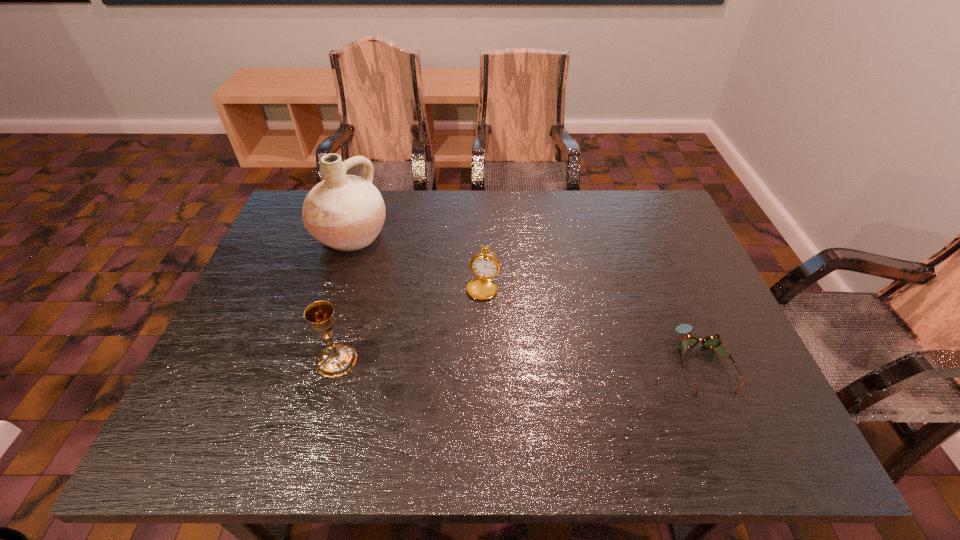
This screenshot has width=960, height=540. I want to click on empty location between the chalice and the second shortest object, so click(x=415, y=324).

You are a GUI agent. You are given a task and a screenshot of the screen. Output one action in this format:
    pyautogui.click(x=<x>, y=<y>)
    Task: Click on the vacant point located between the spectacles and the pottery
    The image size is (960, 540).
    Given the screenshot: What is the action you would take?
    pyautogui.click(x=527, y=298)

In order to click on unoccupied area between the rightmost object and the second object from right to left in this screenshot , I will do `click(598, 325)`.

The image size is (960, 540). Identify the location of vacant region between the shortest object and the farthest object. (527, 298).

At what (x,y) coordinates should I click in order to perform the action: click on free area in between the chalice and the rightmost object. Please return your answer as a coordinate pair (x, y). This screenshot has height=540, width=960. Looking at the image, I should click on click(x=519, y=361).

The image size is (960, 540). Find the location of `vacant space that is in between the shortest object and the tallest object`. vacant space that is in between the shortest object and the tallest object is located at coordinates (527, 298).

Identify which object is the second closest to the pottery. Please provide its 2D coordinates. Your answer should be formatted as a tuple, i.e. [(x, y)], where the tuple contains the x and y coordinates of a point satisfying the conditions above.

[(337, 360)]

The image size is (960, 540). I want to click on the third closest object to the pocket watch, so click(x=712, y=341).

The width and height of the screenshot is (960, 540). What are the coordinates of `vacant space that satisfies the following two spatial constraints: 1. on the front side of the third shortest object; 2. on the right side of the farthest object` in the screenshot? It's located at (311, 360).